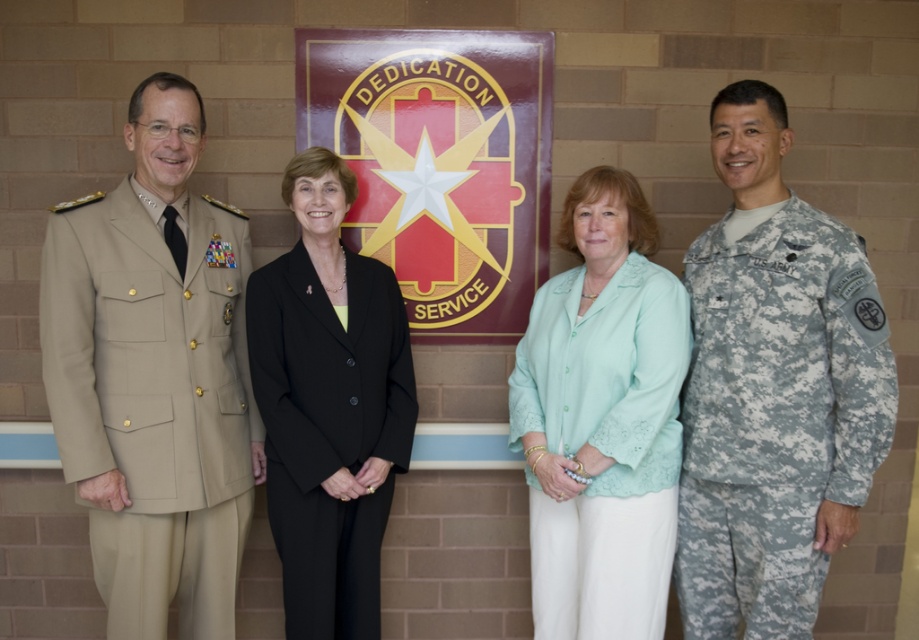
Question: Can you confirm if tan fabric uniform at left is positioned below black fabric suit at center?

Choices:
 (A) yes
 (B) no

Answer: (B)

Question: Which is nearer to the tan fabric uniform at left?

Choices:
 (A) light green fabric blouse at center
 (B) black fabric suit at center
 (C) camouflage fabric uniform at right

Answer: (B)

Question: Observing the image, what is the correct spatial positioning of tan fabric uniform at left in reference to camouflage fabric uniform at right?

Choices:
 (A) above
 (B) below

Answer: (A)

Question: Among these objects, which one is farthest from the camera?

Choices:
 (A) tan fabric uniform at left
 (B) black fabric suit at center
 (C) light green fabric blouse at center

Answer: (B)

Question: Among these points, which one is farthest from the camera?

Choices:
 (A) (666, 436)
 (B) (407, 355)
 (C) (795, 536)
 (D) (138, 490)

Answer: (B)

Question: Does camouflage fabric uniform at right appear over light green fabric blouse at center?

Choices:
 (A) yes
 (B) no

Answer: (B)